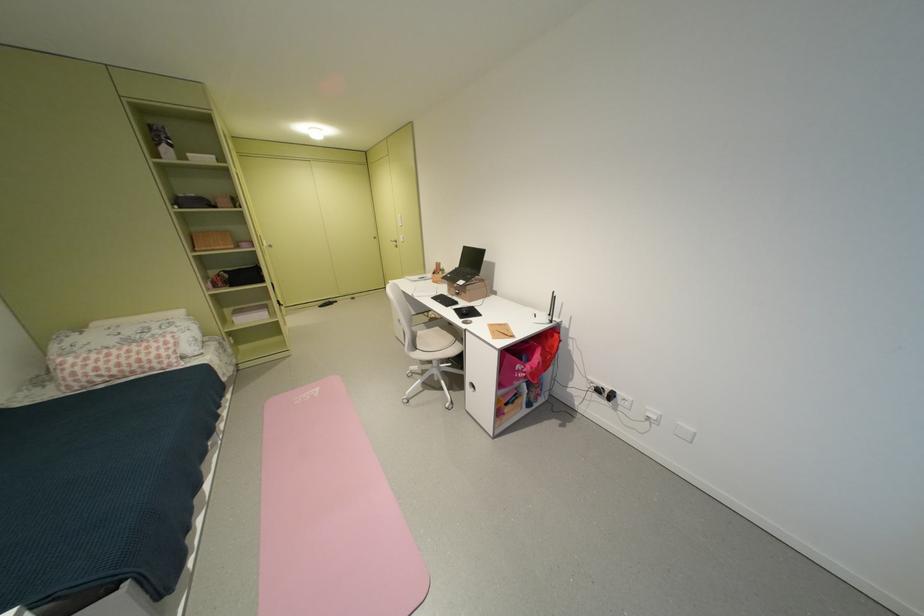
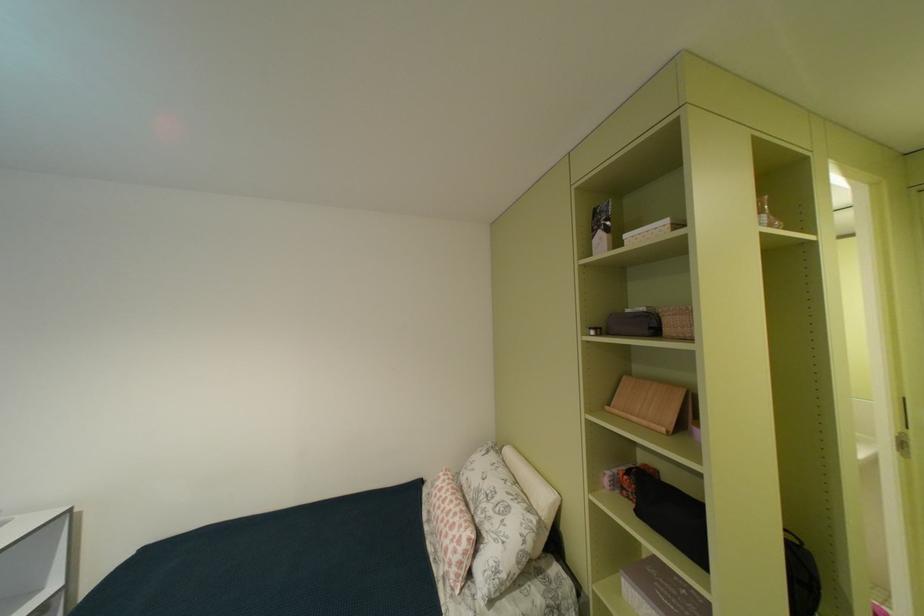
In the second image, find the point that corresponds to point 228,207 in the first image.

(675, 331)